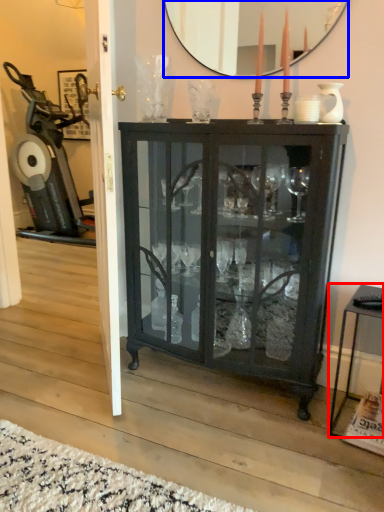
Question: Which point is closer to the camera, table (highlighted by a red box) or mirror (highlighted by a blue box)?

Choices:
 (A) table
 (B) mirror

Answer: (A)